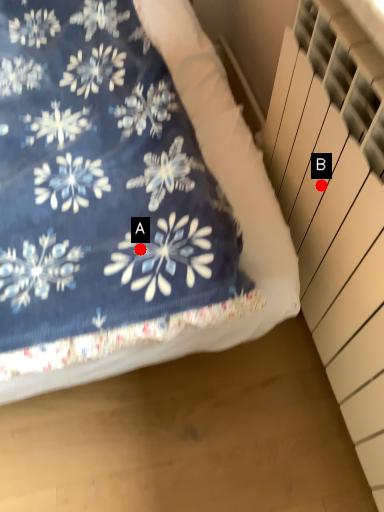
Question: Two points are circled on the image, labeled by A and B beside each circle. Among these points, which one is farthest from the camera?

Choices:
 (A) A is further
 (B) B is further

Answer: (B)